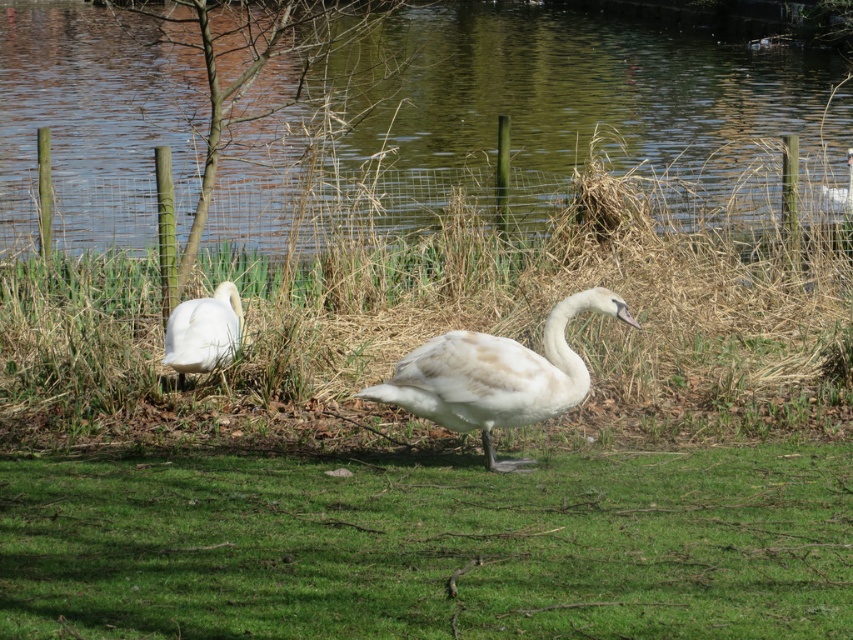
Which of these two, green grass at center or green water at center, stands shorter?

green grass at center is shorter.

What do you see at coordinates (430, 547) in the screenshot?
I see `green grass at center` at bounding box center [430, 547].

Where is `green grass at center`? green grass at center is located at coordinates (430, 547).

This screenshot has width=853, height=640. I want to click on green grass at center, so click(x=430, y=547).

Can you confirm if green grass at center is taller than white matte swan at center?

In fact, green grass at center may be shorter than white matte swan at center.

Does point (596, 531) come farther from viewer compared to point (485, 392)?

That is False.

Is point (93, 524) closer to camera compared to point (453, 422)?

Yes, it is.

Where is `green grass at center`? The width and height of the screenshot is (853, 640). green grass at center is located at coordinates (430, 547).

Between white feathered swan at left and white feathered swan at upper right, which one is positioned lower?

white feathered swan at left is below.

Is white feathered swan at left further to camera compared to white feathered swan at upper right?

No, it is not.

Does point (236, 346) come farther from viewer compared to point (848, 198)?

No, (236, 346) is in front of (848, 198).

You are a GUI agent. You are given a task and a screenshot of the screen. Output one action in this format:
    pyautogui.click(x=<x>, y=<y>)
    Task: Click on the white feathered swan at left
    
    Given the screenshot: What is the action you would take?
    [204, 332]